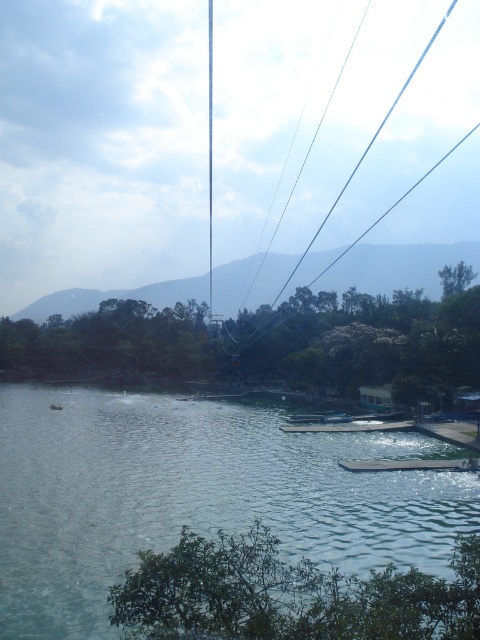
Between greenish-blue water at lower left and black wire at upper center, which one appears on the left side from the viewer's perspective?

Positioned to the left is greenish-blue water at lower left.

Does greenish-blue water at lower left appear on the left side of black wire at upper center?

Yes, greenish-blue water at lower left is to the left of black wire at upper center.

Is point (261, 509) more distant than point (392, 205)?

No.

Find the location of `greenish-blue water at lower left`. greenish-blue water at lower left is located at coordinates (195, 497).